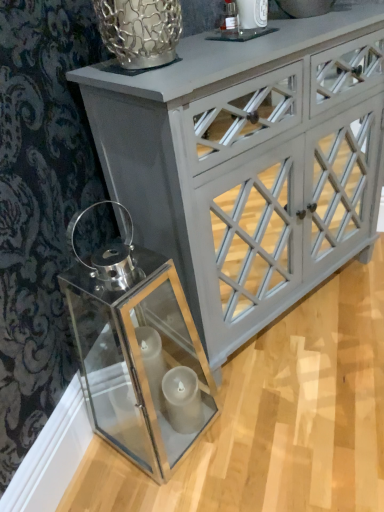
Question: Looking at the image, does white painted wood cabinet at upper center seem bigger or smaller compared to clear glass lantern at lower left?

Choices:
 (A) small
 (B) big

Answer: (B)

Question: Is point (163, 244) positioned closer to the camera than point (172, 359)?

Choices:
 (A) farther
 (B) closer

Answer: (B)

Question: Is white painted wood cabinet at upper center wider or thinner than clear glass lantern at lower left?

Choices:
 (A) thin
 (B) wide

Answer: (B)

Question: In terms of size, does clear glass lantern at lower left appear bigger or smaller than white painted wood cabinet at upper center?

Choices:
 (A) small
 (B) big

Answer: (A)

Question: Considering their positions, is clear glass lantern at lower left located in front of or behind white painted wood cabinet at upper center?

Choices:
 (A) front
 (B) behind

Answer: (A)

Question: From a real-world perspective, is clear glass lantern at lower left positioned above or below white painted wood cabinet at upper center?

Choices:
 (A) above
 (B) below

Answer: (B)

Question: Is clear glass lantern at lower left taller or shorter than white painted wood cabinet at upper center?

Choices:
 (A) tall
 (B) short

Answer: (B)